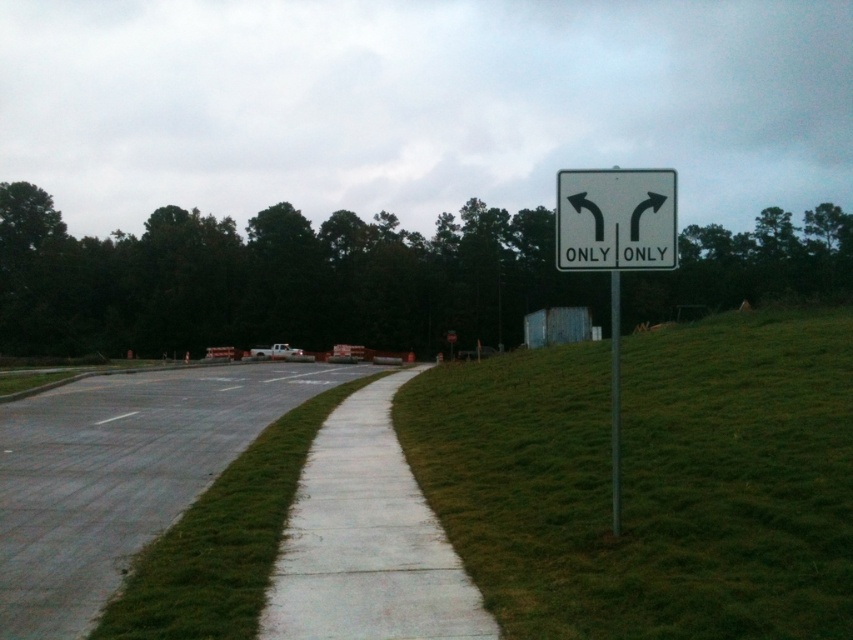
Question: Can you confirm if gray asphalt pavement at lower left is thinner than white plastic sign at upper right?

Choices:
 (A) no
 (B) yes

Answer: (A)

Question: Which of these objects is positioned farthest from the metallic pole at right?

Choices:
 (A) white plastic sign at upper right
 (B) green grass at right
 (C) gray asphalt pavement at lower left
 (D) white metallic sign at right

Answer: (C)

Question: Among these objects, which one is nearest to the camera?

Choices:
 (A) white plastic sign at upper right
 (B) metallic pole at right

Answer: (A)

Question: Observing the image, what is the correct spatial positioning of gray asphalt pavement at lower left in reference to white concrete sidewalk at center?

Choices:
 (A) left
 (B) right

Answer: (A)

Question: Which is farther from the gray asphalt pavement at lower left?

Choices:
 (A) white plastic sign at upper right
 (B) white metallic sign at right

Answer: (B)

Question: In this image, where is green grass at right located relative to white plastic sign at upper right?

Choices:
 (A) below
 (B) above

Answer: (A)